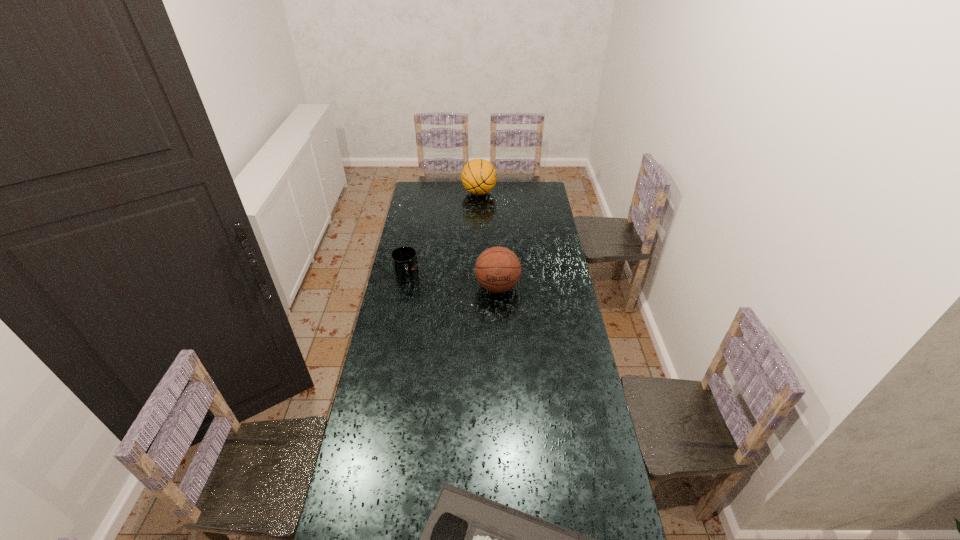
The image size is (960, 540). Identify the location of empty space that is in between the leftmost object and the nearer basketball. point(452,282).

Identify the location of free spot between the nearer basketball and the farthest object. Image resolution: width=960 pixels, height=540 pixels. [x=488, y=240].

I want to click on empty space that is in between the farthest object and the nearer basketball, so pos(488,240).

The width and height of the screenshot is (960, 540). What are the coordinates of `object that stands as the third closest to the nearer basketball` in the screenshot? It's located at (468, 539).

Locate which object is the third closest to the nearer basketball. Please provide its 2D coordinates. Your answer should be formatted as a tuple, i.e. [(x, y)], where the tuple contains the x and y coordinates of a point satisfying the conditions above.

[(468, 539)]